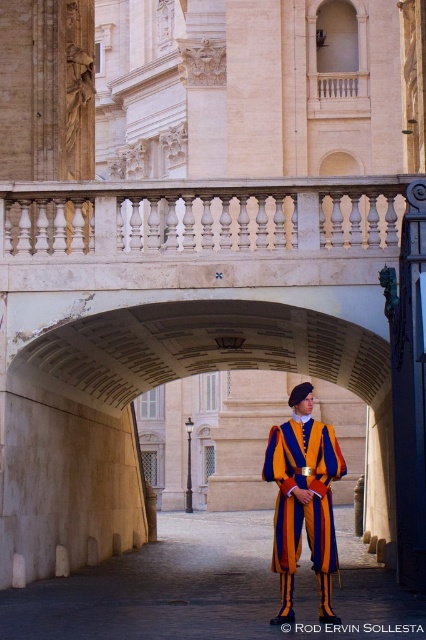
Who is more distant from viewer, (316, 182) or (313, 433)?

The point (316, 182) is behind.

Between white marble balustrade at upper center and orange-yellow striped uniform at center, which one is positioned higher?

white marble balustrade at upper center is higher up.

Between point (396, 232) and point (307, 490), which one is positioned behind?

Point (396, 232)

Find the location of a particular element. This screenshot has width=426, height=640. white marble balustrade at upper center is located at coordinates (201, 216).